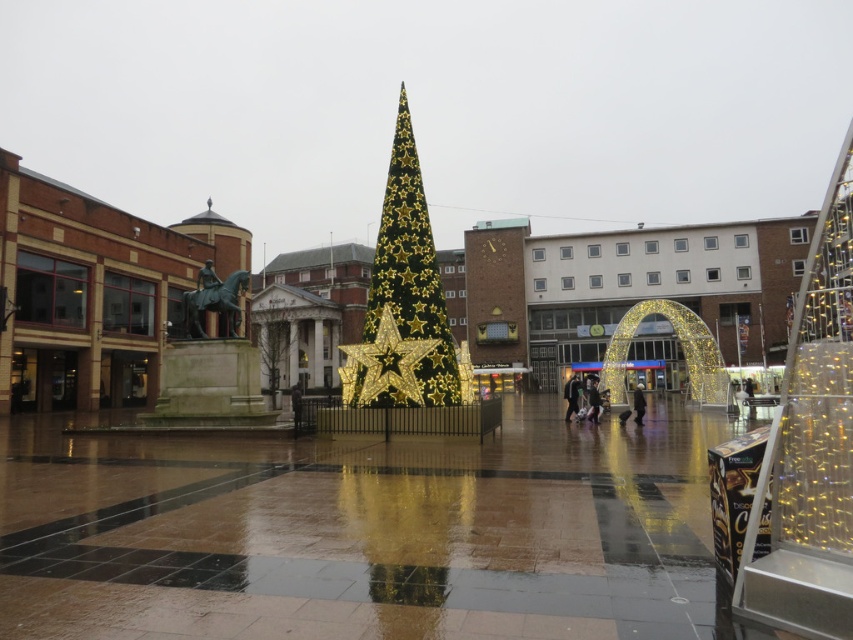
Looking at this image, is gold metallic star at center shorter than dark blue jeans at lower right?

Yes.

The width and height of the screenshot is (853, 640). What do you see at coordinates (380, 364) in the screenshot? I see `gold metallic star at center` at bounding box center [380, 364].

Is point (405, 360) closer to camera compared to point (631, 408)?

Yes, point (405, 360) is in front of point (631, 408).

What are the coordinates of `gold metallic star at center` in the screenshot? It's located at (380, 364).

Can you confirm if gold metallic tree at center is shorter than dark brown leather jacket at lower right?

No, gold metallic tree at center is not shorter than dark brown leather jacket at lower right.

Is gold metallic tree at center below dark brown leather jacket at lower right?

Actually, gold metallic tree at center is above dark brown leather jacket at lower right.

Does point (252, 320) come in front of point (566, 392)?

No, it is not.

This screenshot has width=853, height=640. I want to click on gold metallic tree at center, so click(273, 337).

Which is more to the right, gold metallic tree at center or matte black jacket at center?

matte black jacket at center is more to the right.

Does gold metallic tree at center have a lesser width compared to matte black jacket at center?

No.

Find the location of a particular element. gold metallic tree at center is located at coordinates (273, 337).